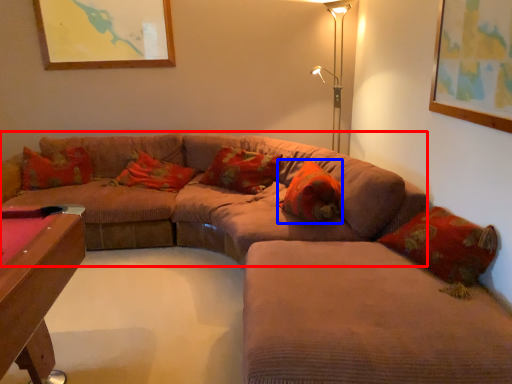
Question: Which object is further to the camera taking this photo, couch (highlighted by a red box) or pillow (highlighted by a blue box)?

Choices:
 (A) couch
 (B) pillow

Answer: (B)